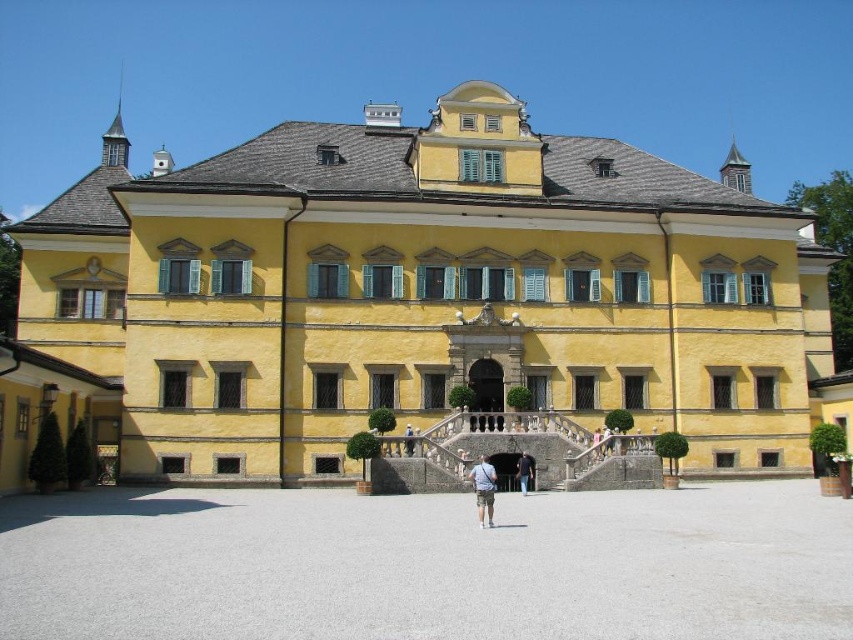
Between point (485, 481) and point (608, 451), which one is positioned in front?

Point (485, 481) is more forward.

Where is `light blue denim shorts at center`? light blue denim shorts at center is located at coordinates (483, 490).

Where is `light blue denim shorts at center`? Image resolution: width=853 pixels, height=640 pixels. light blue denim shorts at center is located at coordinates (483, 490).

Is light blue denim shorts at center to the left of brown leather backpack at center from the viewer's perspective?

No, light blue denim shorts at center is not to the left of brown leather backpack at center.

Who is more distant from viewer, (489, 509) or (405, 435)?

Positioned behind is point (405, 435).

Is point (473, 484) more distant than point (408, 444)?

No.

This screenshot has height=640, width=853. I want to click on light blue denim shorts at center, so point(483,490).

Is brown leather bag at lower center below brown leather backpack at center?

Yes.

Which is behind, point (601, 440) or point (409, 452)?

Point (601, 440)

You are a GUI agent. You are given a task and a screenshot of the screen. Output one action in this format:
    pyautogui.click(x=<x>, y=<y>)
    Task: Click on the brown leather bag at lower center
    The image size is (853, 640).
    Given the screenshot: What is the action you would take?
    pos(596,444)